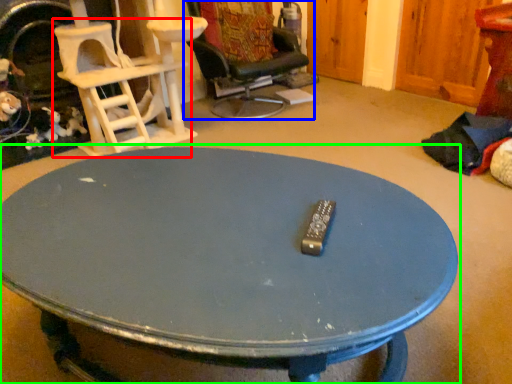
Question: Estimate the real-world distances between objects in this image. Which object is closer to chair (highlighted by a red box), chair (highlighted by a blue box) or coffee table (highlighted by a green box)?

Choices:
 (A) chair
 (B) coffee table

Answer: (A)